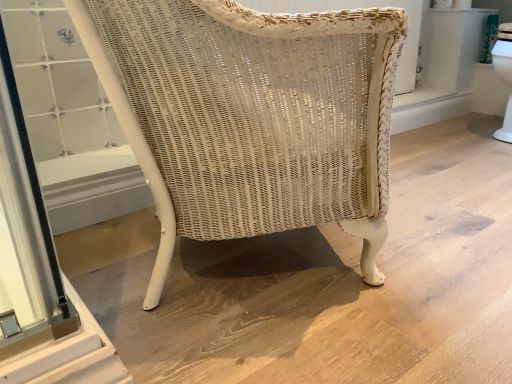
Question: From the image's perspective, is metallic silver screen door at lower left located beneath white wicker chair at center?

Choices:
 (A) yes
 (B) no

Answer: (A)

Question: Does metallic silver screen door at lower left have a lesser height compared to white wicker chair at center?

Choices:
 (A) no
 (B) yes

Answer: (B)

Question: Does metallic silver screen door at lower left have a larger size compared to white wicker chair at center?

Choices:
 (A) yes
 (B) no

Answer: (B)

Question: Is metallic silver screen door at lower left facing away from white wicker chair at center?

Choices:
 (A) no
 (B) yes

Answer: (A)

Question: Considering the relative sizes of metallic silver screen door at lower left and white wicker chair at center in the image provided, is metallic silver screen door at lower left taller than white wicker chair at center?

Choices:
 (A) yes
 (B) no

Answer: (B)

Question: From a real-world perspective, is metallic silver screen door at lower left positioned over white wicker chair at center based on gravity?

Choices:
 (A) yes
 (B) no

Answer: (B)

Question: Is white wicker chair at center positioned with its back to metallic silver screen door at lower left?

Choices:
 (A) no
 (B) yes

Answer: (B)

Question: Is white wicker chair at center to the right of metallic silver screen door at lower left from the viewer's perspective?

Choices:
 (A) yes
 (B) no

Answer: (A)

Question: From a real-world perspective, is white wicker chair at center positioned over metallic silver screen door at lower left based on gravity?

Choices:
 (A) no
 (B) yes

Answer: (B)

Question: From the image's perspective, is white wicker chair at center beneath metallic silver screen door at lower left?

Choices:
 (A) yes
 (B) no

Answer: (B)

Question: Considering the relative positions of white wicker chair at center and metallic silver screen door at lower left in the image provided, is white wicker chair at center to the left of metallic silver screen door at lower left from the viewer's perspective?

Choices:
 (A) yes
 (B) no

Answer: (B)

Question: Can you confirm if white wicker chair at center is thinner than metallic silver screen door at lower left?

Choices:
 (A) no
 (B) yes

Answer: (A)

Question: Considering their positions, is metallic silver screen door at lower left located in front of or behind white wicker chair at center?

Choices:
 (A) front
 (B) behind

Answer: (B)